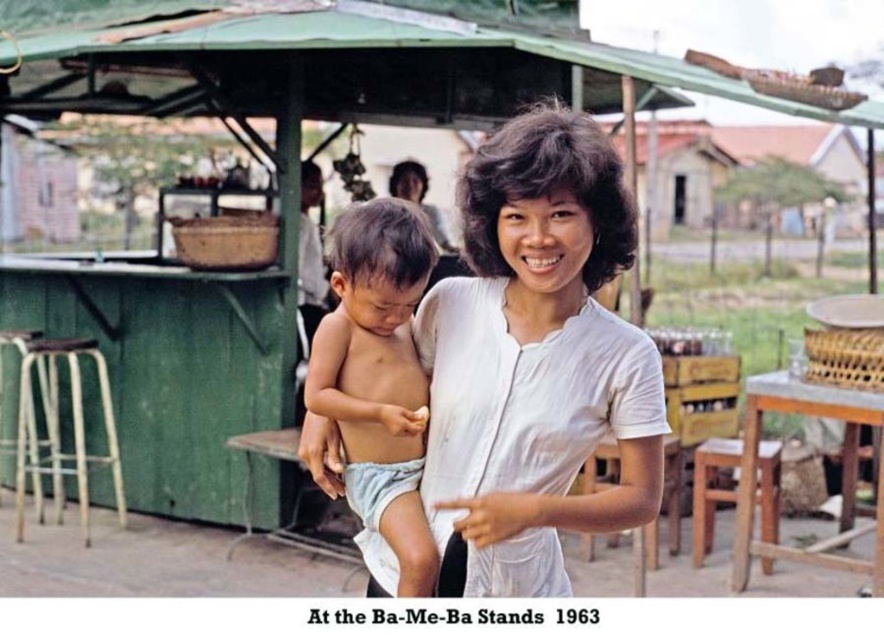
Question: Which object is closer to the camera taking this photo?

Choices:
 (A) metallic silver stool at left
 (B) green fabric canopy at upper center

Answer: (B)

Question: Is white cotton shirt at center to the right of light brown skin/soft skin"object at center from the viewer's perspective?

Choices:
 (A) yes
 (B) no

Answer: (A)

Question: Does light brown skin/soft skin"object at center appear on the right side of wooden stool at lower right?

Choices:
 (A) yes
 (B) no

Answer: (B)

Question: Does white cotton shirt at center have a larger size compared to light brown skin/soft skin"object at center?

Choices:
 (A) yes
 (B) no

Answer: (A)

Question: Which point is farther from the camera taking this photo?

Choices:
 (A) (52, 45)
 (B) (719, 502)
 (C) (75, 429)

Answer: (B)

Question: Among these points, which one is nearest to the camera?

Choices:
 (A) (500, 429)
 (B) (764, 102)
 (C) (761, 448)
 (D) (40, 518)

Answer: (A)